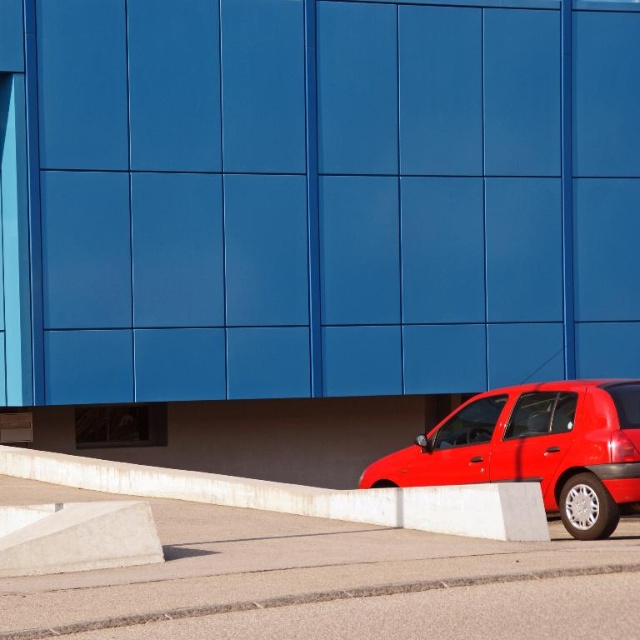
Question: Does glossy red car at lower right come in front of white concrete curb at lower right?

Choices:
 (A) no
 (B) yes

Answer: (A)

Question: Does glossy red car at lower right have a smaller size compared to white concrete curb at lower right?

Choices:
 (A) no
 (B) yes

Answer: (B)

Question: Is glossy red car at lower right wider than white concrete curb at lower right?

Choices:
 (A) yes
 (B) no

Answer: (B)

Question: Which point appears closest to the camera in this image?

Choices:
 (A) (577, 532)
 (B) (364, 496)

Answer: (A)